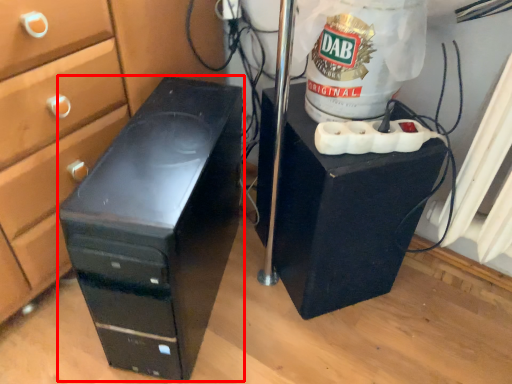
Question: Considering the relative positions of furniture (annotated by the red box) and furniture in the image provided, where is furniture (annotated by the red box) located with respect to the staircase?

Choices:
 (A) right
 (B) left

Answer: (B)